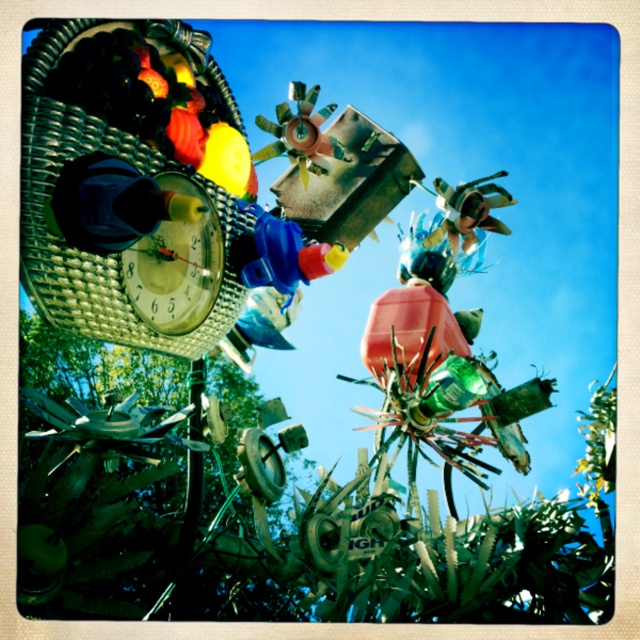
Question: Does metallic clock at upper left lie behind blue plastic toy at center?

Choices:
 (A) yes
 (B) no

Answer: (B)

Question: Which of the following is the closest to the observer?

Choices:
 (A) (292, 232)
 (B) (314, 99)
 (C) (61, 202)

Answer: (C)

Question: From the image, what is the correct spatial relationship of metallic woven basket at upper left in relation to blue plastic toy at center?

Choices:
 (A) right
 (B) left

Answer: (B)

Question: Which of the following is the closest to the observer?

Choices:
 (A) (28, 148)
 (B) (243, 284)

Answer: (A)

Question: Which of these objects is positioned farthest from the matte black toy at upper left?

Choices:
 (A) metallic woven basket at upper left
 (B) metallic clock at upper left
 (C) metallic windmill at center

Answer: (C)

Question: Is matte black toy at upper left above metallic windmill at center?

Choices:
 (A) no
 (B) yes

Answer: (A)